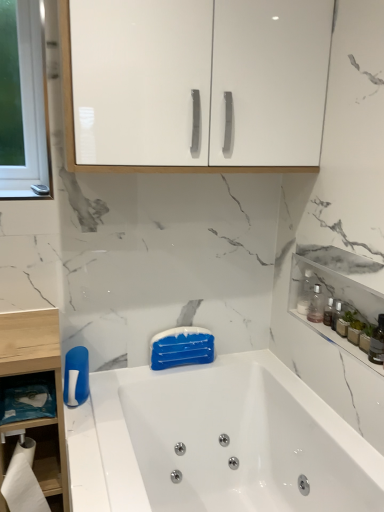
Find the location of a particular element. Image resolution: width=384 pixels, height=512 pixels. white glossy bathtub at center is located at coordinates (240, 441).

Looking at this image, how much space does translucent glass bottles at upper right, the first cabinetry when ordered from bottom to top, occupy horizontally?

It is 4.88 inches.

Image resolution: width=384 pixels, height=512 pixels. I want to click on transparent plastic bottle at right, so (305, 293).

The height and width of the screenshot is (512, 384). In order to click on blue matte bar of soap at center in this screenshot , I will do `click(181, 347)`.

Where is `white glossy bathtub at center`? The width and height of the screenshot is (384, 512). white glossy bathtub at center is located at coordinates (240, 441).

From the image's perspective, is translucent glass bottles at upper right, the 1th cabinetry in the right-to-left sequence, on white glossy cabinet at upper center, the 2th cabinetry positioned from the right?

No, from the image's perspective, translucent glass bottles at upper right, the 1th cabinetry in the right-to-left sequence, is not over white glossy cabinet at upper center, the 2th cabinetry positioned from the right.

From the picture: Is translucent glass bottles at upper right, the first cabinetry when ordered from bottom to top, taller than white glossy cabinet at upper center, the 2th cabinetry positioned from the right?

Incorrect, the height of translucent glass bottles at upper right, the first cabinetry when ordered from bottom to top, is not larger of that of white glossy cabinet at upper center, the 2th cabinetry positioned from the right.

Considering the positions of objects translucent glass bottles at upper right, the 1th cabinetry in the right-to-left sequence, and white glossy cabinet at upper center, arranged as the first cabinetry when viewed from the left, in the image provided, who is more to the left, translucent glass bottles at upper right, the 1th cabinetry in the right-to-left sequence, or white glossy cabinet at upper center, arranged as the first cabinetry when viewed from the left,?

From the viewer's perspective, white glossy cabinet at upper center, arranged as the first cabinetry when viewed from the left, appears more on the left side.

Is translucent glass bottles at upper right, arranged as the second cabinetry when viewed from the top, inside or outside of white glossy cabinet at upper center, arranged as the first cabinetry when viewed from the left?

translucent glass bottles at upper right, arranged as the second cabinetry when viewed from the top, is located beyond the bounds of white glossy cabinet at upper center, arranged as the first cabinetry when viewed from the left.

The image size is (384, 512). In order to click on bottle behind the white glossy cabinet at upper center, acting as the 1th cabinetry starting from the top in this screenshot , I will do `click(305, 293)`.

From a real-world perspective, is transparent plastic bottle at right physically located above or below white glossy cabinet at upper center, acting as the 1th cabinetry starting from the top?

In terms of real-world spatial position, transparent plastic bottle at right is below white glossy cabinet at upper center, acting as the 1th cabinetry starting from the top.

Which object is positioned more to the right, transparent plastic bottle at right or white glossy cabinet at upper center, acting as the 1th cabinetry starting from the top?

transparent plastic bottle at right.

From the image's perspective, between translucent glass bottle at right and transparent plastic bottle at right, who is located below?

translucent glass bottle at right.

Considering the positions of point (380, 348) and point (302, 286), is point (380, 348) closer or farther from the camera than point (302, 286)?

Point (380, 348) is positioned closer to the camera compared to point (302, 286).

Would you say translucent glass bottle at right is to the left or to the right of transparent plastic bottle at right in the picture?

Clearly, translucent glass bottle at right is on the right of transparent plastic bottle at right in the image.

Is white glossy bathtub at center to the left or to the right of clear plastic bottle at upper right in the image?

white glossy bathtub at center is positioned on clear plastic bottle at upper right's left side.

From the picture: Does white glossy bathtub at center come behind clear plastic bottle at upper right?

No, the depth of white glossy bathtub at center is less than that of clear plastic bottle at upper right.

Is clear plastic bottle at upper right at the back of white glossy bathtub at center?

white glossy bathtub at center is not turned away from clear plastic bottle at upper right.

Based on the photo, considering the positions of objects clear plastic bottle at upper right and white paper at lower left in the image provided, who is more to the right, clear plastic bottle at upper right or white paper at lower left?

From the viewer's perspective, clear plastic bottle at upper right appears more on the right side.

Is clear plastic bottle at upper right aimed at white paper at lower left?

Yes, clear plastic bottle at upper right is facing white paper at lower left.

Can we say clear plastic bottle at upper right lies outside white paper at lower left?

Yes.

Can you see clear plastic bottle at upper right touching white paper at lower left?

clear plastic bottle at upper right and white paper at lower left are clearly separated.

Is white paper at lower left placed right next to clear plastic bottle at upper right?

No, white paper at lower left is not touching clear plastic bottle at upper right.

Identify the location of cleaning product behind the white paper at lower left. (316, 305).

Based on the photo, which is behind, white paper at lower left or clear plastic bottle at upper right?

Positioned behind is clear plastic bottle at upper right.

From a real-world perspective, does white paper at lower left sit lower than clear plastic bottle at upper right?

Yes, from a real-world perspective, white paper at lower left is beneath clear plastic bottle at upper right.

Is point (314, 291) farther from viewer compared to point (359, 301)?

Yes, point (314, 291) is behind point (359, 301).

From a real-world perspective, is clear plastic bottle at upper right above or below translucent glass bottles at upper right, the 1th cabinetry in the right-to-left sequence?

In terms of real-world spatial position, clear plastic bottle at upper right is above translucent glass bottles at upper right, the 1th cabinetry in the right-to-left sequence.

Considering the relative sizes of clear plastic bottle at upper right and translucent glass bottles at upper right, the 1th cabinetry in the right-to-left sequence, in the image provided, is clear plastic bottle at upper right taller than translucent glass bottles at upper right, the 1th cabinetry in the right-to-left sequence,?

Correct, clear plastic bottle at upper right is much taller as translucent glass bottles at upper right, the 1th cabinetry in the right-to-left sequence.

Is the surface of clear plastic bottle at upper right in direct contact with translucent glass bottles at upper right, which is the second cabinetry from left to right?

No.

Where is `cabinetry on the right of white glossy cabinet at upper center, which is the second cabinetry from bottom to top`? The height and width of the screenshot is (512, 384). cabinetry on the right of white glossy cabinet at upper center, which is the second cabinetry from bottom to top is located at coordinates (336, 290).

Find the location of a particular element. cabinetry above the transparent plastic bottle at right (from the image's perspective) is located at coordinates (195, 84).

Looking at the image, which one is located further to white paper at lower left, white glossy bathtub at center or translucent glass bottles at upper right, the 1th cabinetry in the right-to-left sequence?

translucent glass bottles at upper right, the 1th cabinetry in the right-to-left sequence, is further to white paper at lower left.

From the image, which object appears to be farther from clear plastic bottle at upper right, white glossy bathtub at center or transparent plastic bottle at right?

white glossy bathtub at center lies further to clear plastic bottle at upper right than the other object.

From the image, which object appears to be farther from blue matte bar of soap at center, clear plastic bottle at upper right or white glossy cabinet at upper center, acting as the 1th cabinetry starting from the top?

Among the two, white glossy cabinet at upper center, acting as the 1th cabinetry starting from the top, is located further to blue matte bar of soap at center.

Considering their positions, is white paper at lower left positioned further to clear plastic bottle at upper right than white glossy cabinet at upper center, acting as the 1th cabinetry starting from the top?

white paper at lower left is positioned further to the anchor clear plastic bottle at upper right.

Looking at the image, which one is located further to white paper at lower left, translucent glass bottle at right or clear plastic bottle at upper right?

translucent glass bottle at right is positioned further to the anchor white paper at lower left.

Based on the photo, looking at the image, which one is located further to transparent plastic bottle at right, white glossy bathtub at center or blue matte bar of soap at center?

white glossy bathtub at center is positioned further to the anchor transparent plastic bottle at right.

Which object lies nearer to the anchor point white glossy bathtub at center, translucent glass bottles at upper right, arranged as the second cabinetry when viewed from the top, or transparent plastic bottle at right?

translucent glass bottles at upper right, arranged as the second cabinetry when viewed from the top, is positioned closer to the anchor white glossy bathtub at center.

From the image, which object appears to be farther from translucent glass bottle at right, white glossy bathtub at center or clear plastic bottle at upper right?

Among the two, white glossy bathtub at center is located further to translucent glass bottle at right.

This screenshot has width=384, height=512. What are the coordinates of `bottle between white glossy cabinet at upper center, the 2th cabinetry positioned from the right, and clear plastic bottle at upper right in the up-down direction` in the screenshot? It's located at [305, 293].

At what (x,y) coordinates should I click in order to perform the action: click on cleaning product between white glossy cabinet at upper center, which is the second cabinetry from bottom to top, and blue matte bar of soap at center, in the vertical direction. Please return your answer as a coordinate pair (x, y). Looking at the image, I should click on (316, 305).

Find the location of a particular element. The width and height of the screenshot is (384, 512). cleaning product between white glossy cabinet at upper center, arranged as the first cabinetry when viewed from the left, and white paper at lower left, in the vertical direction is located at coordinates (316, 305).

Identify the location of bottle between white glossy cabinet at upper center, acting as the 1th cabinetry starting from the top, and white glossy bathtub at center, in the vertical direction. (305, 293).